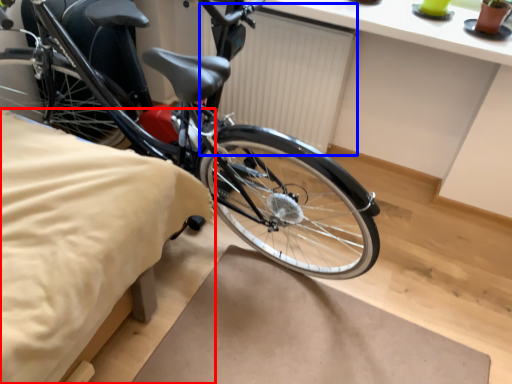
Question: Which object appears closest to the camera in this image, sheet (highlighted by a red box) or radiator (highlighted by a blue box)?

Choices:
 (A) sheet
 (B) radiator

Answer: (A)